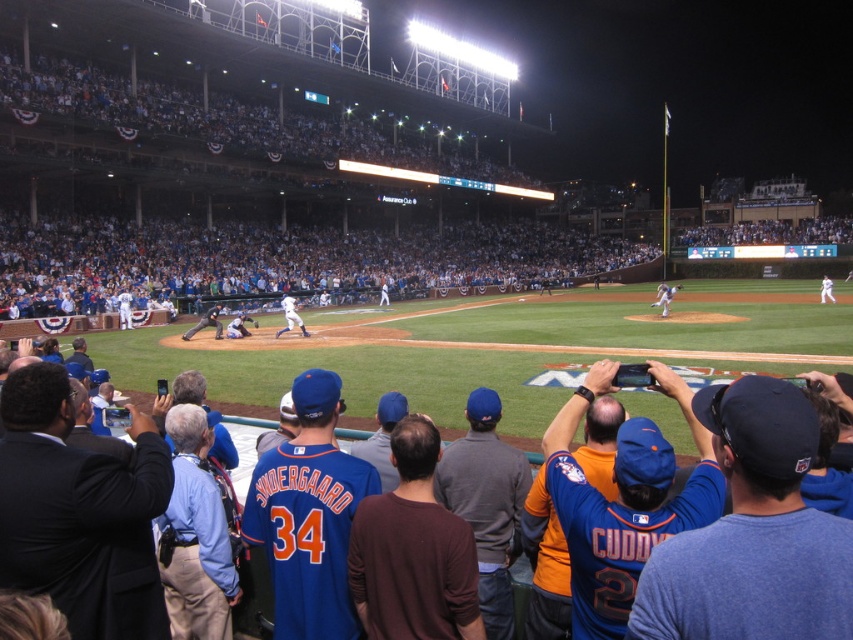
You are a photographer at the stadium and want to take a photo of the white uniform pitcher at center and the blue jersey at center. Which one is positioned to the right of the other?

The white uniform pitcher at center is to the right of the blue jersey at center.